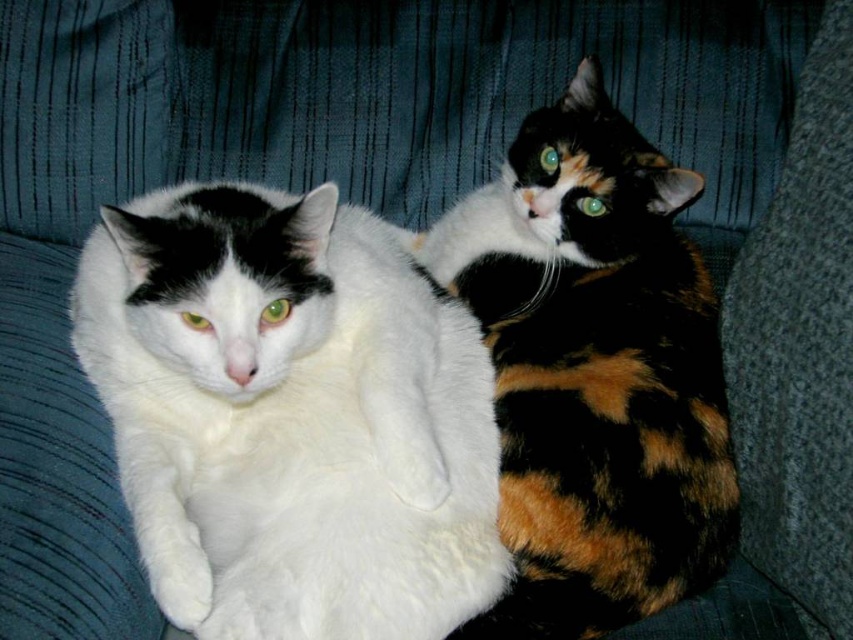
You are a photographer trying to capture a photo of both cats. Since the white fluffy cat at left is looking directly at the camera, but the calico fur cat at right is looking away, which cat should you focus on to ensure both are in the frame?

You should focus on the white fluffy cat at left because it is positioned on the left side of calico fur cat at right, ensuring both are within the frame when centered on the left cat.

You are a photographer trying to capture both cats in a single frame. Given that the white fluffy cat at left is wider than the calico fur cat at right, which cat should you position closer to the center of the frame to ensure both fit comfortably within the shot?

Position the white fluffy cat at left closer to the center of the frame since it is wider than the calico fur cat at right, allowing both to fit better in the shot.